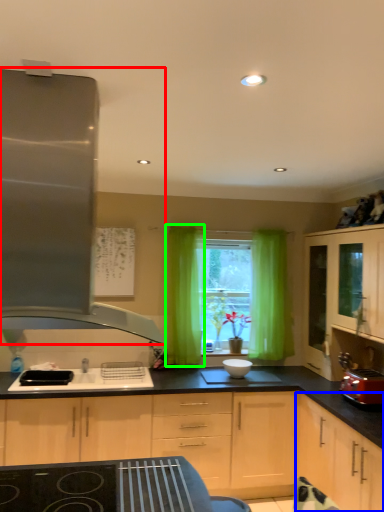
Question: Based on their relative distances, which object is farther from kitchen appliance (highlighted by a red box)? Choose from cabinetry (highlighted by a blue box) and curtain (highlighted by a green box).

Choices:
 (A) cabinetry
 (B) curtain

Answer: (B)